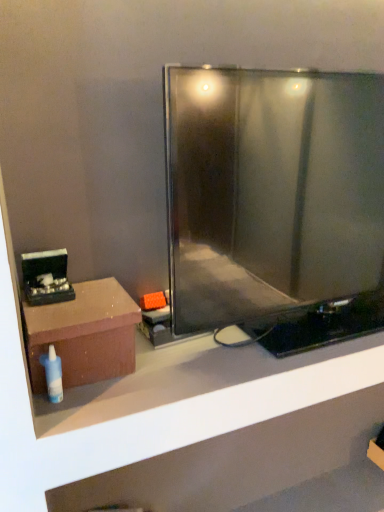
Question: Is white plastic bottle at lower left turned away from black glossy jewelry box at left?

Choices:
 (A) yes
 (B) no

Answer: (B)

Question: Considering the relative positions of white plastic bottle at lower left and black glossy jewelry box at left in the image provided, is white plastic bottle at lower left behind black glossy jewelry box at left?

Choices:
 (A) no
 (B) yes

Answer: (A)

Question: Does white plastic bottle at lower left appear on the right side of black glossy jewelry box at left?

Choices:
 (A) no
 (B) yes

Answer: (B)

Question: From a real-world perspective, is white plastic bottle at lower left below black glossy jewelry box at left?

Choices:
 (A) yes
 (B) no

Answer: (A)

Question: From the image's perspective, does white plastic bottle at lower left appear lower than black glossy jewelry box at left?

Choices:
 (A) no
 (B) yes

Answer: (B)

Question: From a real-world perspective, is white plastic bottle at lower left over black glossy jewelry box at left?

Choices:
 (A) yes
 (B) no

Answer: (B)

Question: Does white plastic bottle at lower left lie in front of brown matte shelf at lower left?

Choices:
 (A) yes
 (B) no

Answer: (B)

Question: Does white plastic bottle at lower left have a smaller size compared to brown matte shelf at lower left?

Choices:
 (A) yes
 (B) no

Answer: (A)

Question: Is white plastic bottle at lower left located outside brown matte shelf at lower left?

Choices:
 (A) no
 (B) yes

Answer: (B)

Question: Is white plastic bottle at lower left further to camera compared to brown matte shelf at lower left?

Choices:
 (A) yes
 (B) no

Answer: (A)

Question: Are white plastic bottle at lower left and brown matte shelf at lower left beside each other?

Choices:
 (A) yes
 (B) no

Answer: (B)

Question: From the image's perspective, would you say white plastic bottle at lower left is positioned over brown matte shelf at lower left?

Choices:
 (A) no
 (B) yes

Answer: (B)

Question: Does matte brown box at left lie in front of brown matte shelf at lower left?

Choices:
 (A) yes
 (B) no

Answer: (B)